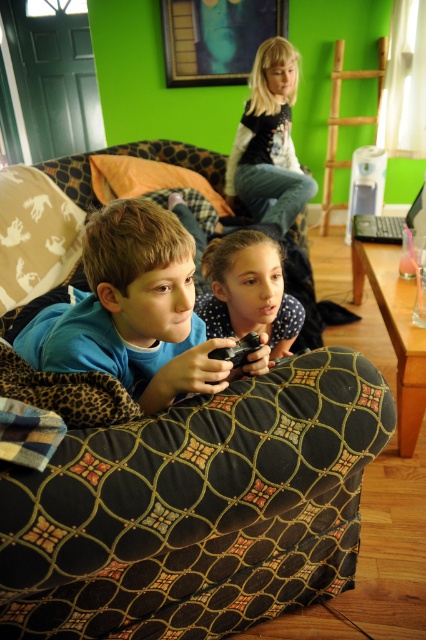
Is black fabric couch at lower center further to the viewer compared to black matte game controller at lower center?

No, black fabric couch at lower center is in front of black matte game controller at lower center.

Which is more to the right, black fabric couch at lower center or black matte game controller at lower center?

From the viewer's perspective, black fabric couch at lower center appears more on the right side.

The image size is (426, 640). What do you see at coordinates (196, 509) in the screenshot?
I see `black fabric couch at lower center` at bounding box center [196, 509].

This screenshot has width=426, height=640. I want to click on black fabric couch at lower center, so click(x=196, y=509).

Between polka dot shirt at center and black matte game controller at lower center, which one appears on the right side from the viewer's perspective?

Positioned to the right is polka dot shirt at center.

Identify the location of polka dot shirt at center. (249, 291).

Does black fabric couch at lower center have a lesser width compared to polka dot shirt at center?

No.

In the scene shown: Who is taller, black fabric couch at lower center or polka dot shirt at center?

Standing taller between the two is black fabric couch at lower center.

Between point (334, 586) and point (203, 253), which one is positioned in front?

Point (334, 586) is more forward.

The width and height of the screenshot is (426, 640). I want to click on black fabric couch at lower center, so click(x=196, y=509).